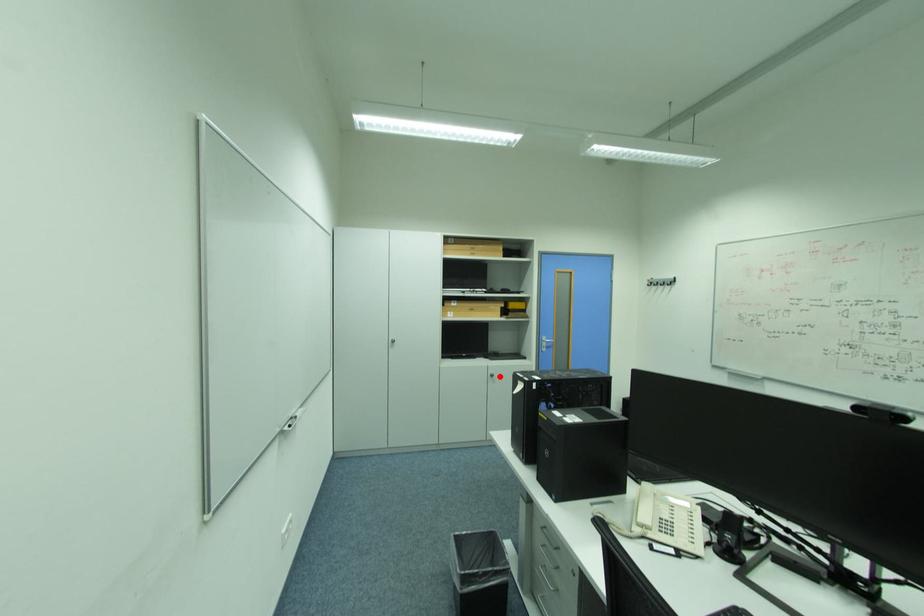
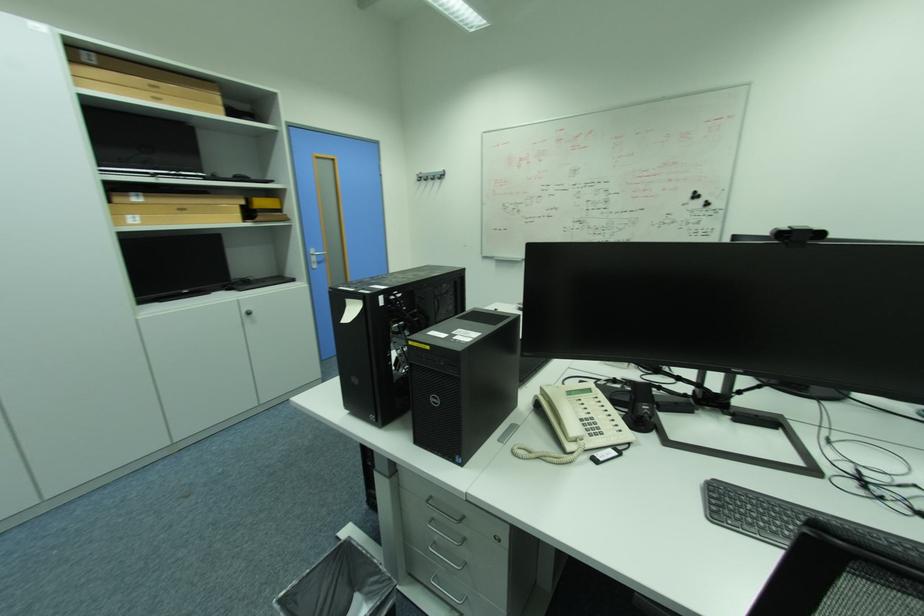
In the second image, find the point that corresponds to the highlighted location in the first image.

(257, 314)